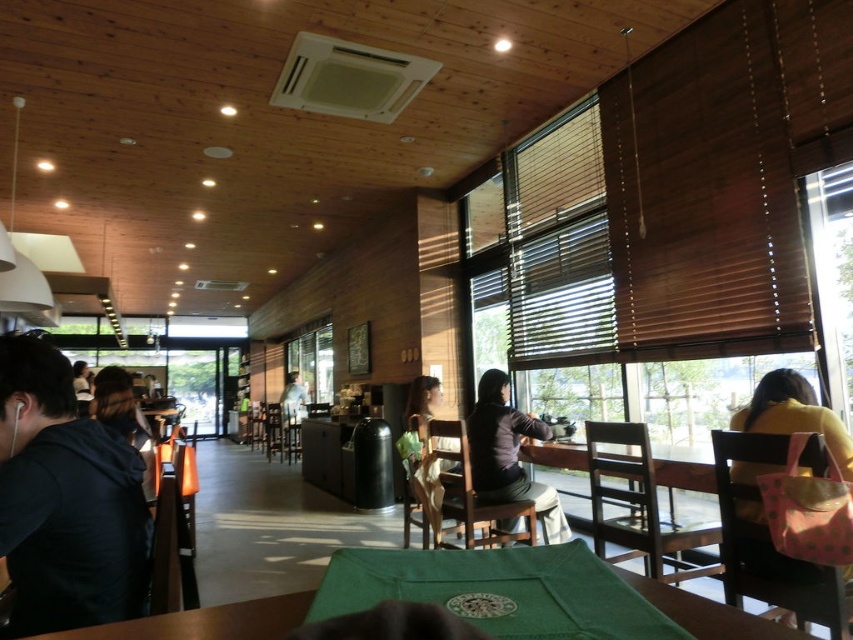
Looking at this image, is yellow matte jacket at right wider than dark brown hair at left?

Incorrect, yellow matte jacket at right's width does not surpass dark brown hair at left's.

Identify the location of yellow matte jacket at right. (793, 413).

Locate an element on the screen. The height and width of the screenshot is (640, 853). yellow matte jacket at right is located at coordinates (793, 413).

Who is positioned more to the right, dark brown hair at left or light brown wooden chair at center?

dark brown hair at left

Where is `dark brown hair at left`? dark brown hair at left is located at coordinates (123, 417).

Locate an element on the screen. dark brown hair at left is located at coordinates (123, 417).

This screenshot has height=640, width=853. Find the location of `dark brown hair at left`. dark brown hair at left is located at coordinates (123, 417).

This screenshot has height=640, width=853. What do you see at coordinates (207, 621) in the screenshot? I see `green fabric table at center` at bounding box center [207, 621].

Does point (271, 628) come closer to viewer compared to point (492, 492)?

Yes, it is.

Who is more forward, (666, 602) or (517, 420)?

Point (666, 602)

The height and width of the screenshot is (640, 853). In order to click on green fabric table at center in this screenshot , I will do `click(207, 621)`.